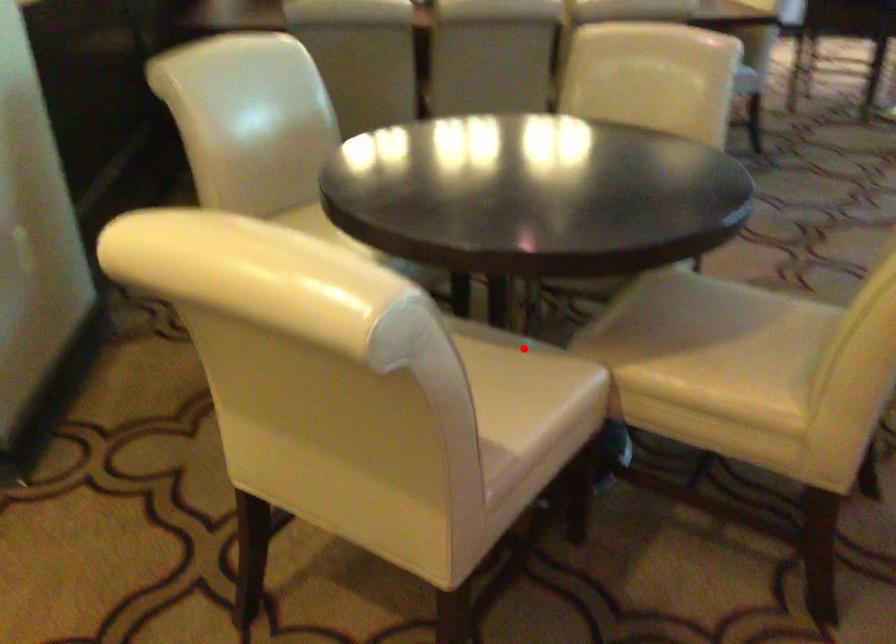
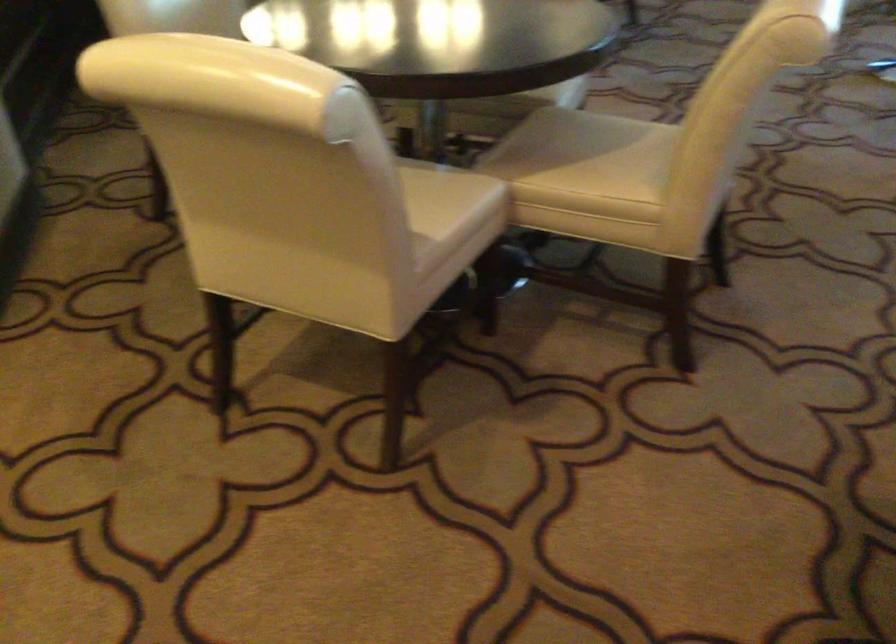
Question: I am providing you with two images of the same scene from different viewpoints. Image1 has a red point marked. In image2, the corresponding 3D location appears at what relative position? Reply with the corresponding letter.

Choices:
 (A) Closer
 (B) Farther

Answer: (B)